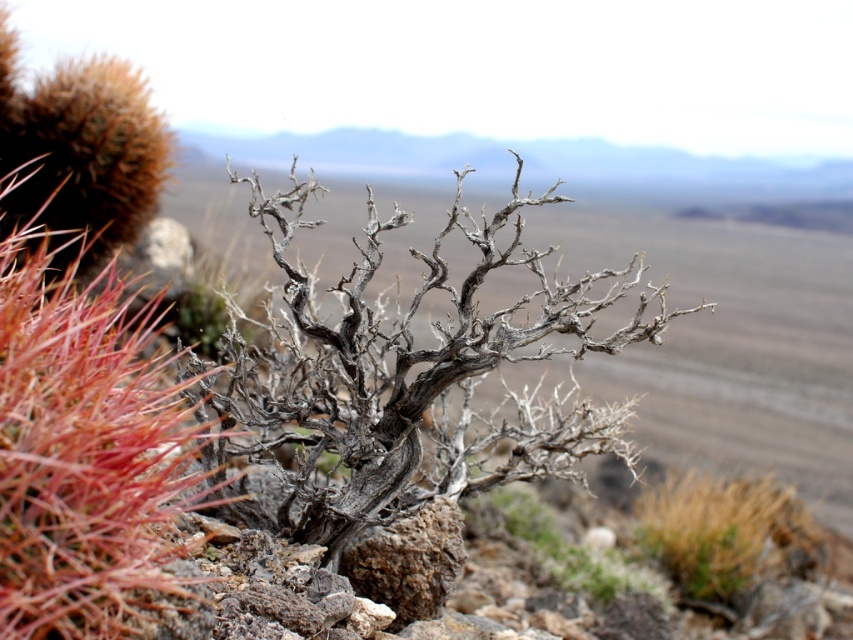
Question: Which of the following is the closest to the observer?

Choices:
 (A) red spiky cactus at left
 (B) dry wood at center
 (C) brown textured grass at lower right

Answer: (A)

Question: Considering the real-world distances, which object is farthest from the gray/dry wood tree at center?

Choices:
 (A) brown textured grass at lower right
 (B) red spiky cactus at left
 (C) dry wood at center

Answer: (A)

Question: Is brown textured grass at lower right further to camera compared to dry wood at center?

Choices:
 (A) no
 (B) yes

Answer: (B)

Question: Which object appears farthest from the camera in this image?

Choices:
 (A) red spiky cactus at left
 (B) brown textured grass at lower right
 (C) gray/dry wood tree at center
 (D) dry wood at center

Answer: (B)

Question: Is brown textured grass at lower right above dry wood at center?

Choices:
 (A) yes
 (B) no

Answer: (A)

Question: Is red spiky cactus at left to the left of brown textured grass at lower right from the viewer's perspective?

Choices:
 (A) yes
 (B) no

Answer: (A)